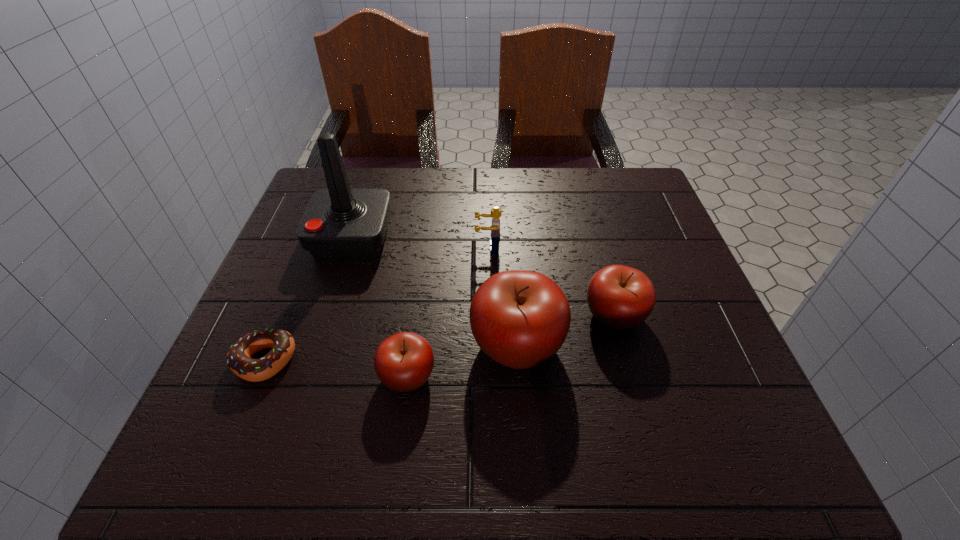
Please point a vacant point for placing a apple on the right. Please provide its 2D coordinates. Your answer should be formatted as a tuple, i.e. [(x, y)], where the tuple contains the x and y coordinates of a point satisfying the conditions above.

[(701, 290)]